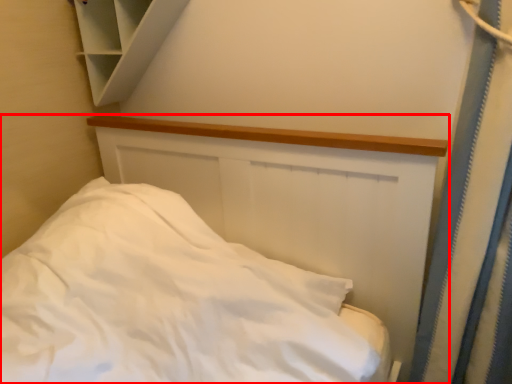
Question: Considering the relative positions of bed (annotated by the red box) and cabinet in the image provided, where is bed (annotated by the red box) located with respect to the staircase?

Choices:
 (A) right
 (B) left

Answer: (A)